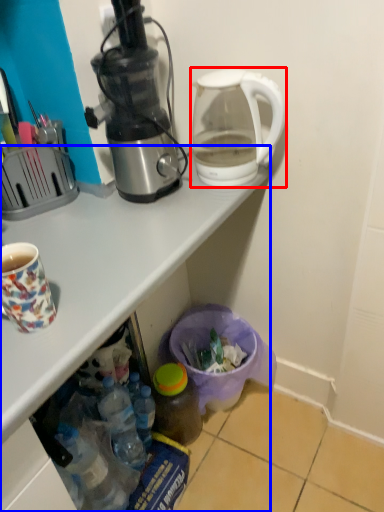
Question: Which of the following is the closest to the observer, kettle (highlighted by a red box) or desk (highlighted by a blue box)?

Choices:
 (A) kettle
 (B) desk

Answer: (B)